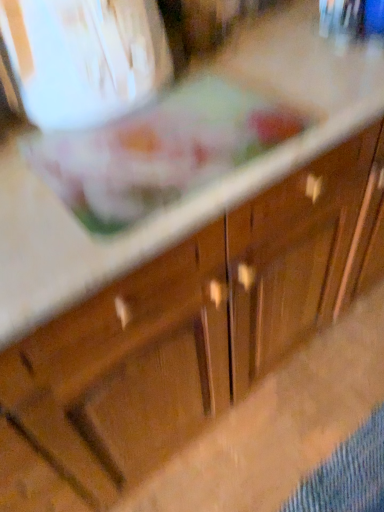
The height and width of the screenshot is (512, 384). Describe the element at coordinates (159, 152) in the screenshot. I see `clear plastic tray at upper center` at that location.

At what (x,y) coordinates should I click in order to perform the action: click on clear plastic tray at upper center. Please return your answer as a coordinate pair (x, y). This screenshot has width=384, height=512. Looking at the image, I should click on (159, 152).

Where is `clear plastic tray at upper center`? The height and width of the screenshot is (512, 384). clear plastic tray at upper center is located at coordinates (159, 152).